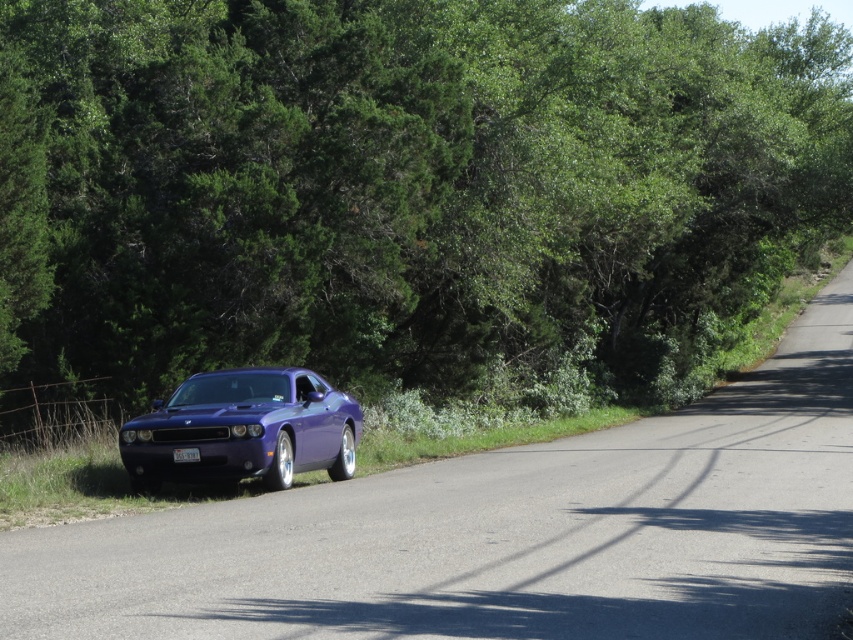
Which of these two, green leafy tree at center or glossy metallic car at center, stands shorter?

Standing shorter between the two is glossy metallic car at center.

Is green leafy tree at center closer to the viewer compared to glossy metallic car at center?

No, green leafy tree at center is behind glossy metallic car at center.

Who is more distant from viewer, (444, 118) or (293, 420)?

The point (444, 118) is more distant.

Identify the location of green leafy tree at center. Image resolution: width=853 pixels, height=640 pixels. (403, 184).